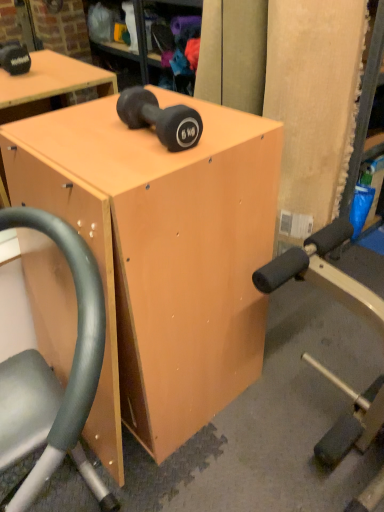
Locate an element on the screen. vacant area in front of matte black dumbbell at center is located at coordinates (138, 165).